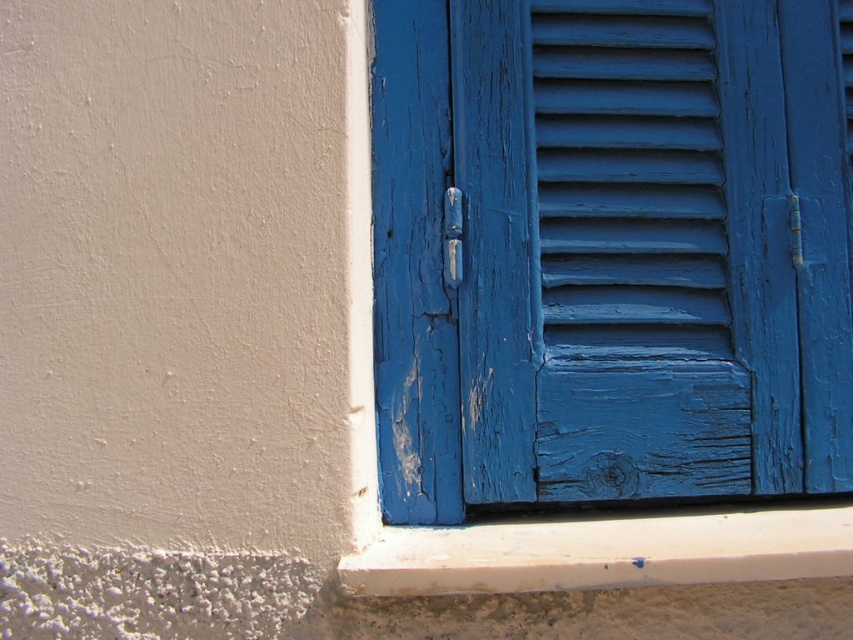
You are a painter holding a 30 cm long brush. You need to paint the blue painted wood shutter at center and the white matte window sill at lower center. Can you reach both objects with your brush without moving closer?

The distance between the blue painted wood shutter at center and the white matte window sill at lower center is 27.79 centimeters. Since your brush is 30 cm long, you can comfortably reach both objects without needing to move closer.

Based on the photo, you are standing in front of the building wall with blue shutters. There are two points marked on the wall at coordinates point [592,157] and point [416,563]. Which point is closer to you?

Point [592,157] is further to the viewer than point [416,563], so the point closer to you is point [416,563].